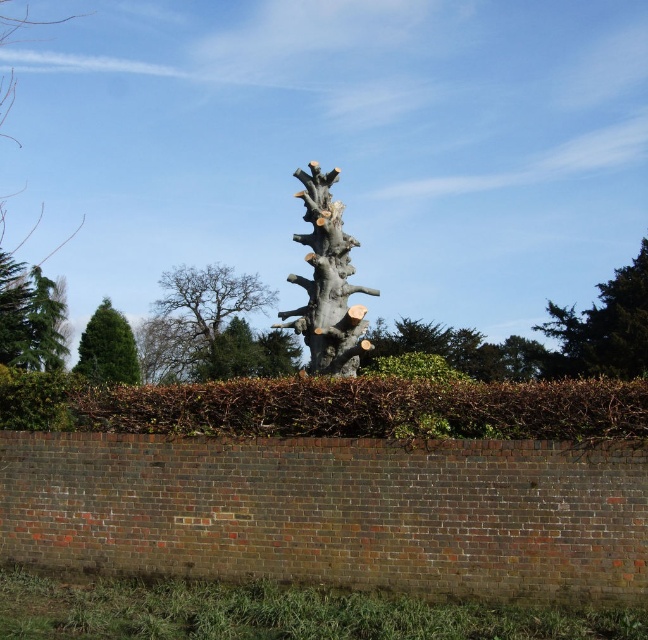
You are a landscape architect designing a garden. You need to place a small statue between the smooth gray tree trunk at upper center and the green textured tree at upper right. Which tree should the statue be closer to if you want it to appear proportionally balanced?

The statue should be closer to the green textured tree at upper right because the smooth gray tree trunk at upper center is smaller, so balancing the statue closer to the larger tree would create a visually harmonious arrangement.

You are a landscape architect designing a garden. You need to place a 3m tall statue between the smooth gray tree trunk at upper center and the green textured tree at upper right. Based on their heights, will the statue be taller than both?

The smooth gray tree trunk at upper center is taller than green textured tree at upper right. Since the statue is 3m tall, we need to compare it with the height of the taller tree. However, the exact heights of the trees are not provided, so we cannot definitively determine if the statue will be taller than both.